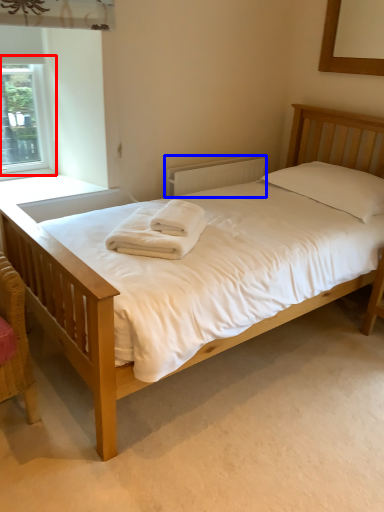
Question: Which object is closer to the camera taking this photo, window (highlighted by a red box) or radiator (highlighted by a blue box)?

Choices:
 (A) window
 (B) radiator

Answer: (A)